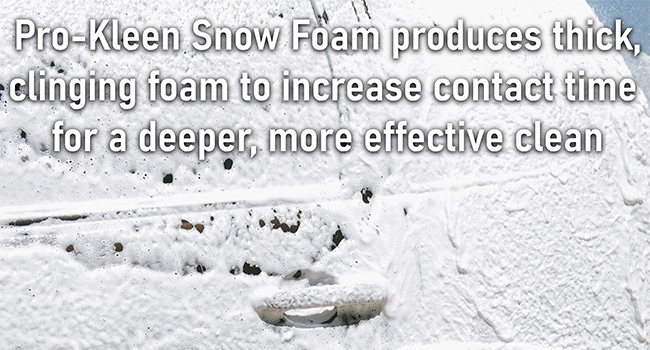
Where is `window frame`? This screenshot has width=650, height=350. window frame is located at coordinates (179, 207), (351, 71), (498, 179).